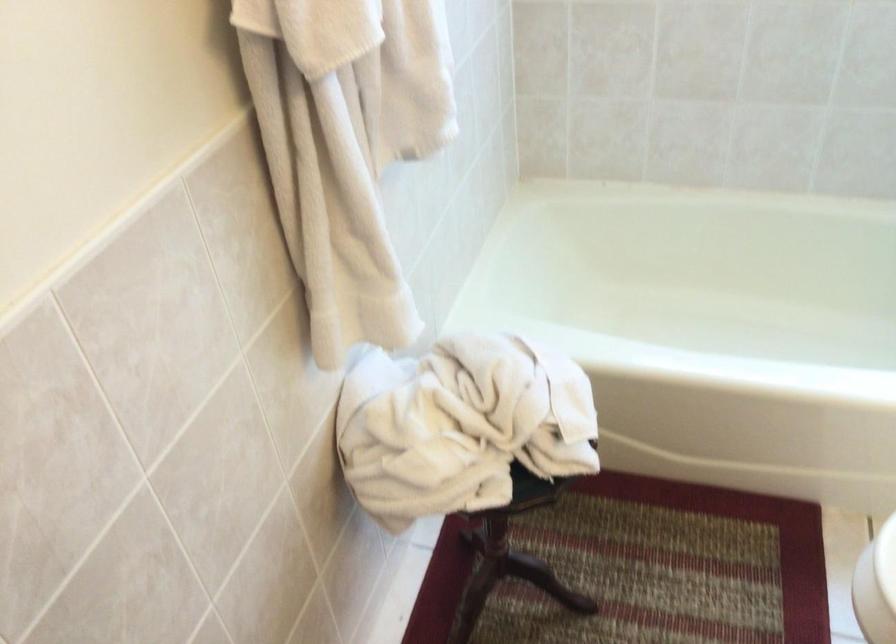
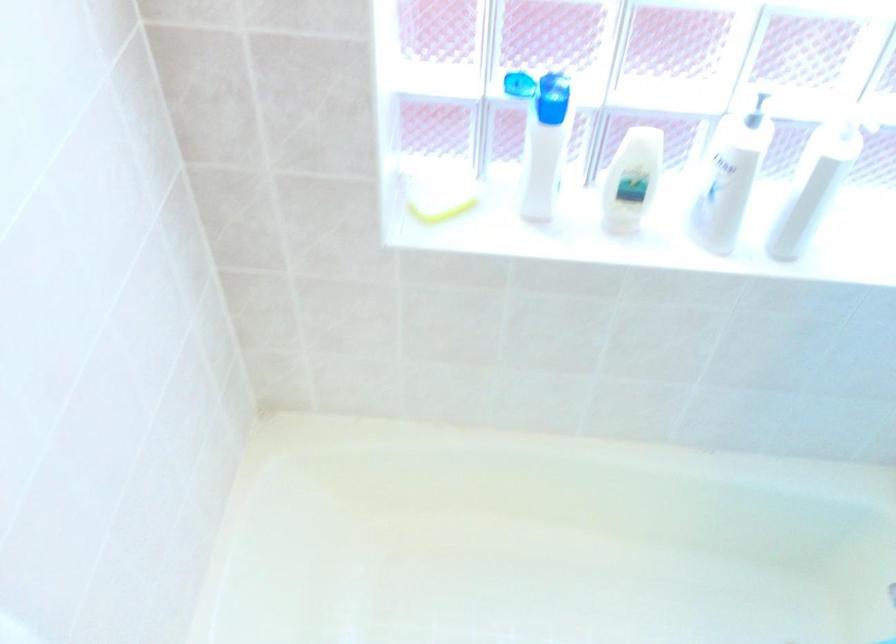
What movement of the cameraman would produce the second image?

The movement direction of the cameraman is right, forward.